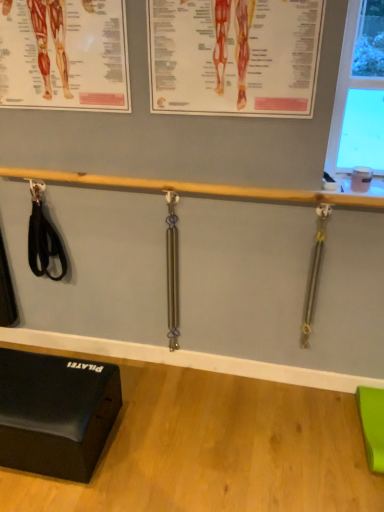
Question: Can you confirm if matte paper poster at upper left, positioned as the second poster page in right-to-left order, is wider than wooden bar at center?

Choices:
 (A) yes
 (B) no

Answer: (B)

Question: Considering the relative positions of matte paper poster at upper left, the first poster page in the left-to-right sequence, and wooden bar at center in the image provided, is matte paper poster at upper left, the first poster page in the left-to-right sequence, to the left of wooden bar at center from the viewer's perspective?

Choices:
 (A) yes
 (B) no

Answer: (A)

Question: Is matte paper poster at upper left, positioned as the second poster page in right-to-left order, placed right next to wooden bar at center?

Choices:
 (A) yes
 (B) no

Answer: (B)

Question: Is wooden bar at center at the back of matte paper poster at upper left, the first poster page in the left-to-right sequence?

Choices:
 (A) no
 (B) yes

Answer: (A)

Question: Is wooden bar at center surrounded by matte paper poster at upper left, positioned as the second poster page in right-to-left order?

Choices:
 (A) no
 (B) yes

Answer: (A)

Question: Is black rubber exercise block at lower left in front of or behind polished metal weight at center, which appears as the 1th weight when viewed from the left, in the image?

Choices:
 (A) front
 (B) behind

Answer: (A)

Question: Looking at the image, does black rubber exercise block at lower left seem bigger or smaller compared to polished metal weight at center, which appears as the 1th weight when viewed from the left?

Choices:
 (A) big
 (B) small

Answer: (A)

Question: From a real-world perspective, relative to polished metal weight at center, the 2th weight in the right-to-left sequence, is black rubber exercise block at lower left vertically above or below?

Choices:
 (A) above
 (B) below

Answer: (B)

Question: Is point (107, 421) closer or farther from the camera than point (175, 321)?

Choices:
 (A) closer
 (B) farther

Answer: (A)

Question: Considering the relative positions of orange paper poster at upper center, which is counted as the 2th poster page, starting from the left, and matte paper poster at upper left, positioned as the second poster page in right-to-left order, in the image provided, is orange paper poster at upper center, which is counted as the 2th poster page, starting from the left, to the left or to the right of matte paper poster at upper left, positioned as the second poster page in right-to-left order,?

Choices:
 (A) right
 (B) left

Answer: (A)

Question: Relative to matte paper poster at upper left, the first poster page in the left-to-right sequence, is orange paper poster at upper center, which is counted as the 2th poster page, starting from the left, in front or behind?

Choices:
 (A) behind
 (B) front

Answer: (B)

Question: Is orange paper poster at upper center, which is counted as the 2th poster page, starting from the left, wider or thinner than matte paper poster at upper left, positioned as the second poster page in right-to-left order?

Choices:
 (A) thin
 (B) wide

Answer: (A)

Question: From the image's perspective, is orange paper poster at upper center, which is counted as the 2th poster page, starting from the left, located above or below matte paper poster at upper left, the first poster page in the left-to-right sequence?

Choices:
 (A) below
 (B) above

Answer: (A)

Question: Considering the positions of gold metallic weight at right, the first weight when ordered from right to left, and polished metal weight at center, the 2th weight in the right-to-left sequence, in the image, is gold metallic weight at right, the first weight when ordered from right to left, wider or thinner than polished metal weight at center, the 2th weight in the right-to-left sequence,?

Choices:
 (A) thin
 (B) wide

Answer: (A)

Question: Based on their positions, is gold metallic weight at right, acting as the 2th weight starting from the left, located to the left or right of polished metal weight at center, which appears as the 1th weight when viewed from the left?

Choices:
 (A) left
 (B) right

Answer: (B)